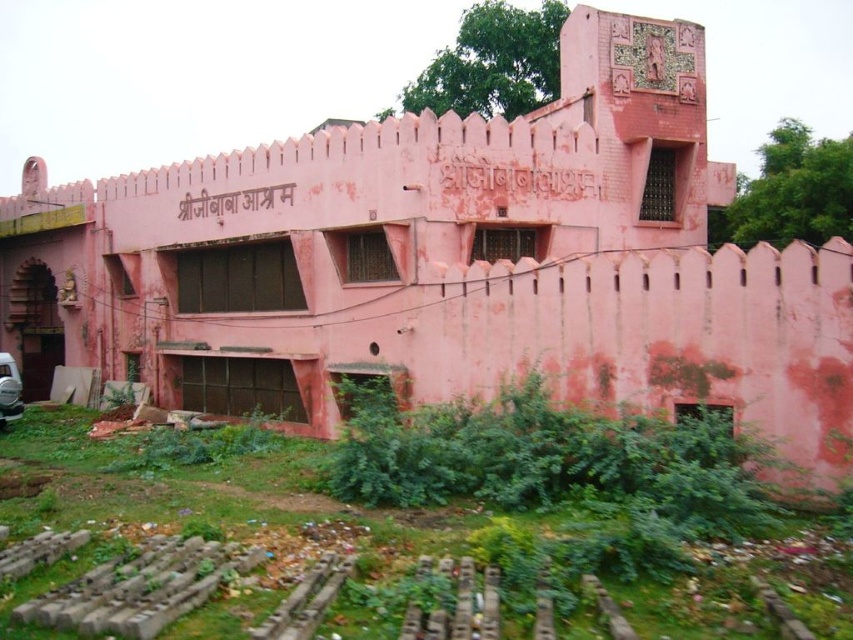
Question: Does green grass at lower left come in front of metallic silver car at lower left?

Choices:
 (A) yes
 (B) no

Answer: (A)

Question: Is green grass at lower left positioned before metallic silver car at lower left?

Choices:
 (A) no
 (B) yes

Answer: (B)

Question: Where is green grass at lower left located in relation to metallic silver car at lower left in the image?

Choices:
 (A) above
 (B) below

Answer: (B)

Question: Which object appears closest to the camera in this image?

Choices:
 (A) metallic silver car at lower left
 (B) green grass at lower left

Answer: (B)